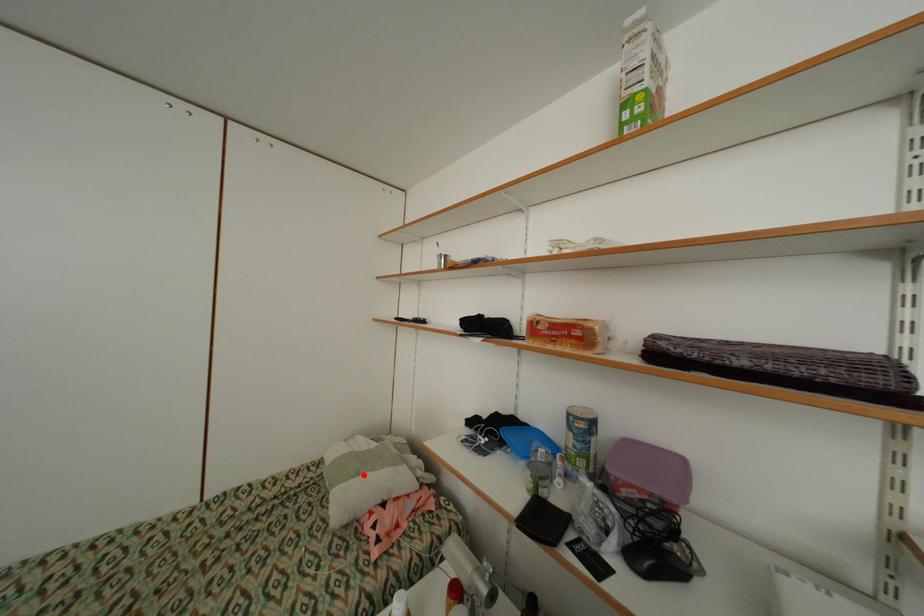
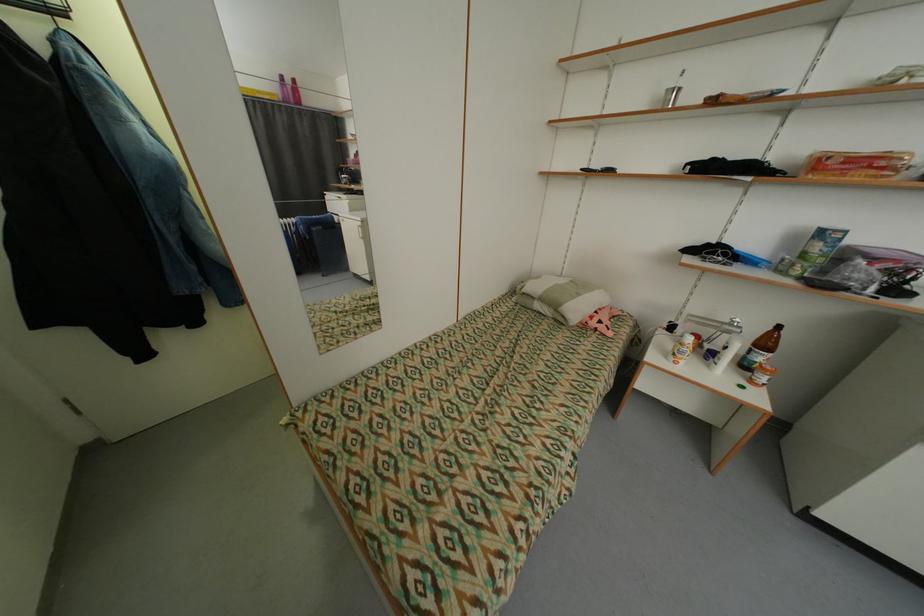
Where in the second image is the point corresponding to the highlighted location from the first image?

(585, 296)